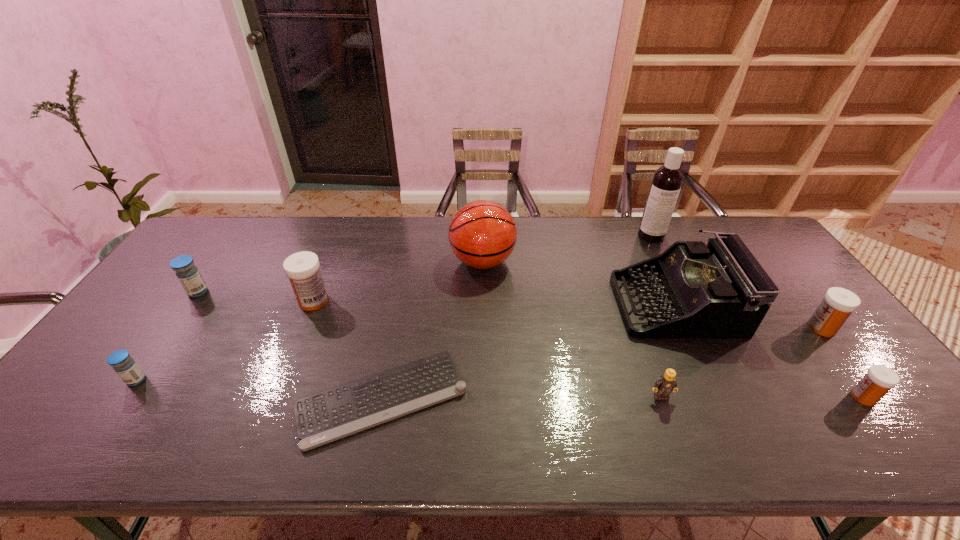
Identify the location of the smallest white medicine. (879, 379).

In order to click on the shortest object in this screenshot , I will do `click(324, 417)`.

I want to click on gray computer keyboard, so click(324, 417).

You are a GUI agent. You are given a task and a screenshot of the screen. Output one action in this format:
    pyautogui.click(x=<x>, y=<y>)
    Task: Click on the free spot located on the label side of the dishwasher detergent
    This screenshot has width=960, height=540.
    Given the screenshot: What is the action you would take?
    pyautogui.click(x=680, y=292)

Where is `vacant area located on the side with spill of the second tallest object`? vacant area located on the side with spill of the second tallest object is located at coordinates (344, 261).

You are a GUI agent. You are given a task and a screenshot of the screen. Output one action in this format:
    pyautogui.click(x=<x>, y=<y>)
    Task: Click on the vacant area situated 0.100m on the side with spill of the second tallest object
    
    Given the screenshot: What is the action you would take?
    pyautogui.click(x=420, y=261)

You are a GUI agent. You are given a task and a screenshot of the screen. Output one action in this format:
    pyautogui.click(x=<x>, y=<y>)
    Task: Click on the free space located 0.130m on the side with spill of the second tallest object
    This screenshot has width=960, height=540.
    Given the screenshot: What is the action you would take?
    pyautogui.click(x=411, y=261)

The image size is (960, 540). In order to click on vacant area situated 0.330m on the typing side of the black typewriter in this screenshot , I will do `click(506, 304)`.

This screenshot has height=540, width=960. I want to click on blank space located 0.330m on the typing side of the black typewriter, so click(506, 304).

At what (x,y) coordinates should I click in order to perform the action: click on vacant space situated on the typing side of the black typewriter. Please return your answer as a coordinate pair (x, y). Looking at the image, I should click on (543, 304).